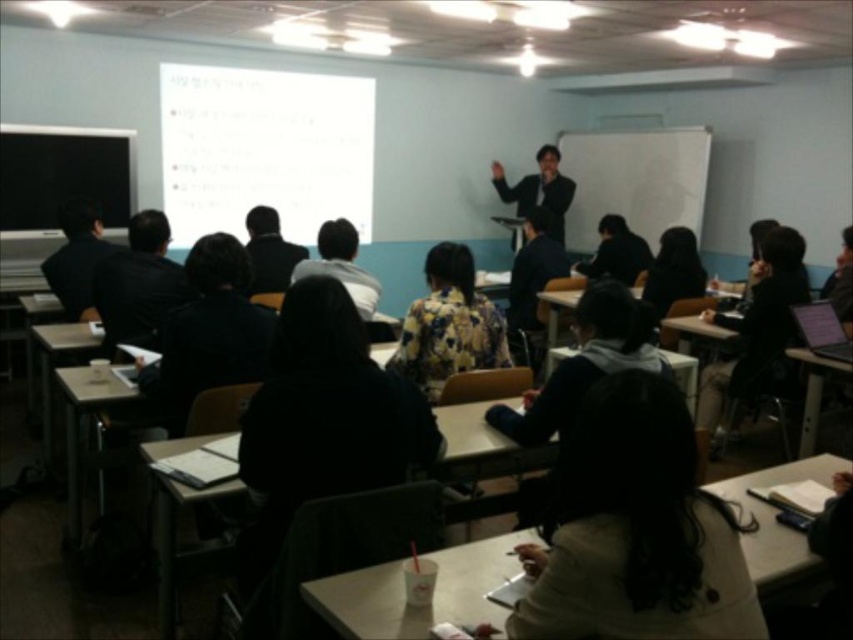
Question: Estimate the real-world distances between objects in this image. Which object is closer to the black suit at center?

Choices:
 (A) black matte jacket at lower center
 (B) black matte jacket at left

Answer: (B)

Question: Does black matte jacket at lower center have a smaller size compared to floral fabric jacket at center?

Choices:
 (A) no
 (B) yes

Answer: (B)

Question: Does black suit at center appear on the right side of floral fabric jacket at center?

Choices:
 (A) no
 (B) yes

Answer: (B)

Question: Considering the real-world distances, which object is closest to the floral fabric jacket at center?

Choices:
 (A) black suit at center
 (B) black matte jacket at lower center
 (C) black matte jacket at left

Answer: (C)

Question: Is black matte jacket at left to the right of floral fabric jacket at center from the viewer's perspective?

Choices:
 (A) no
 (B) yes

Answer: (A)

Question: Which object is positioned closest to the black suit at center?

Choices:
 (A) black matte jacket at left
 (B) floral fabric jacket at center
 (C) black matte jacket at lower center

Answer: (B)